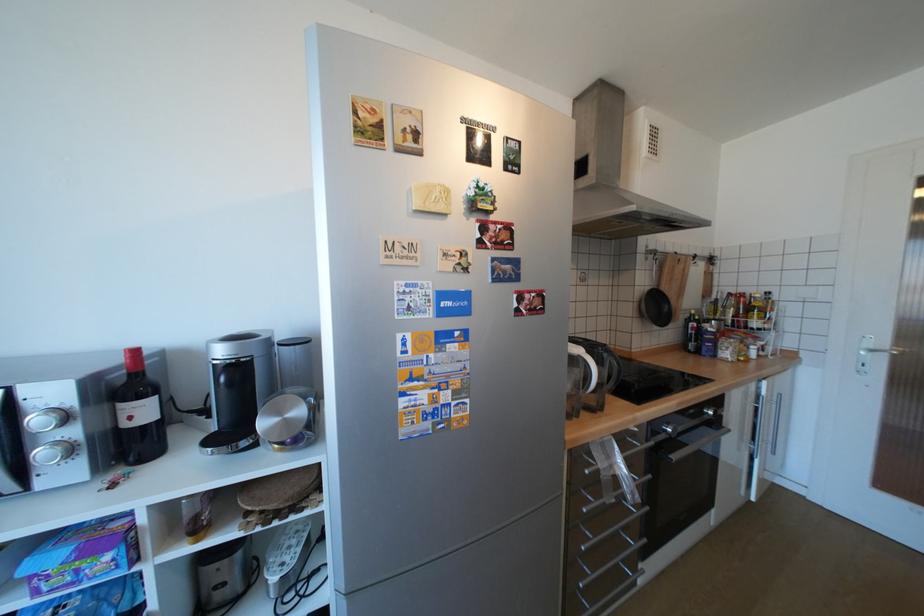
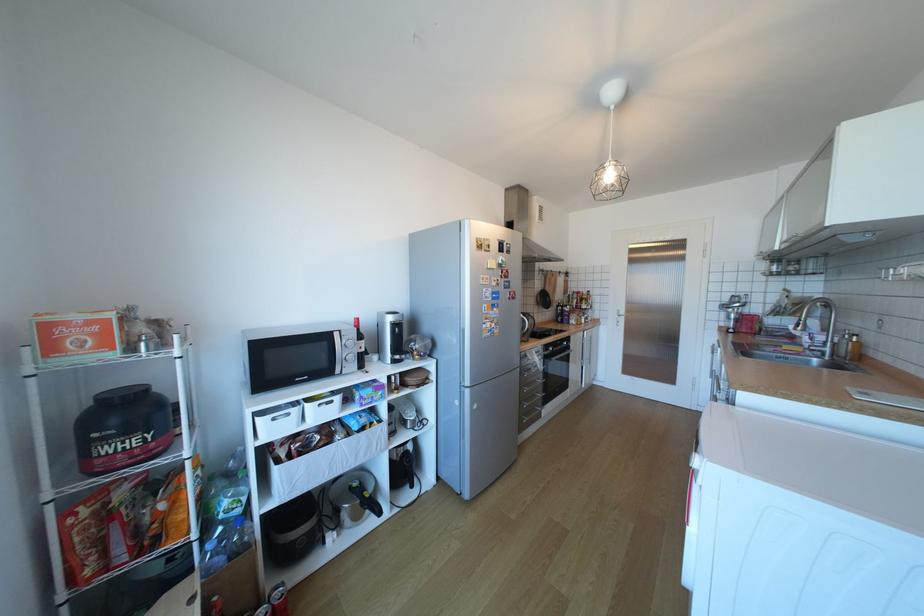
Where in the second image is the point corresponding to point (601, 347) from the first image?

(532, 314)